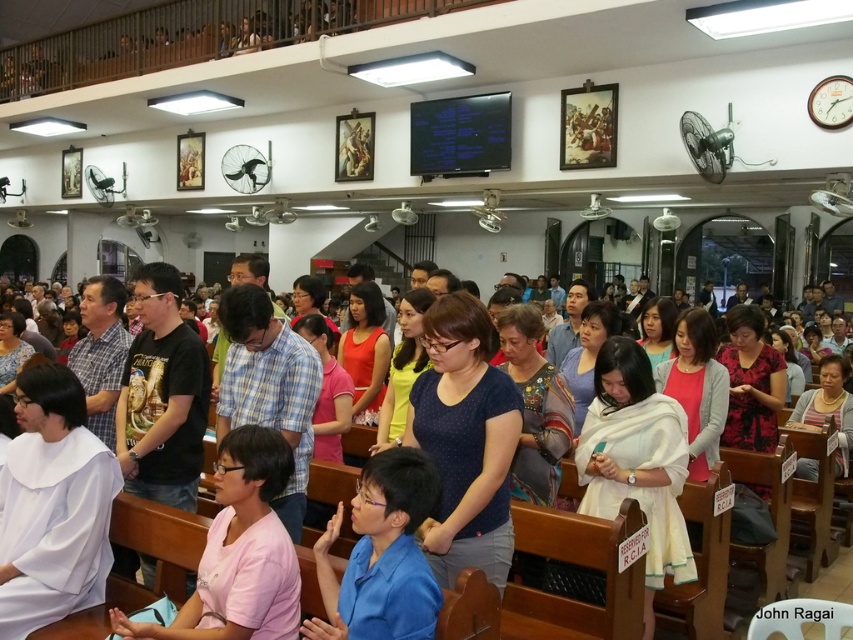
Describe the element at coordinates (381, 556) in the screenshot. I see `blue fabric shirt at center` at that location.

Which is in front, point (351, 605) or point (155, 520)?

Point (351, 605) is more forward.

Is point (404, 612) behind point (155, 508)?

No, it is not.

The image size is (853, 640). I want to click on blue fabric shirt at center, so click(381, 556).